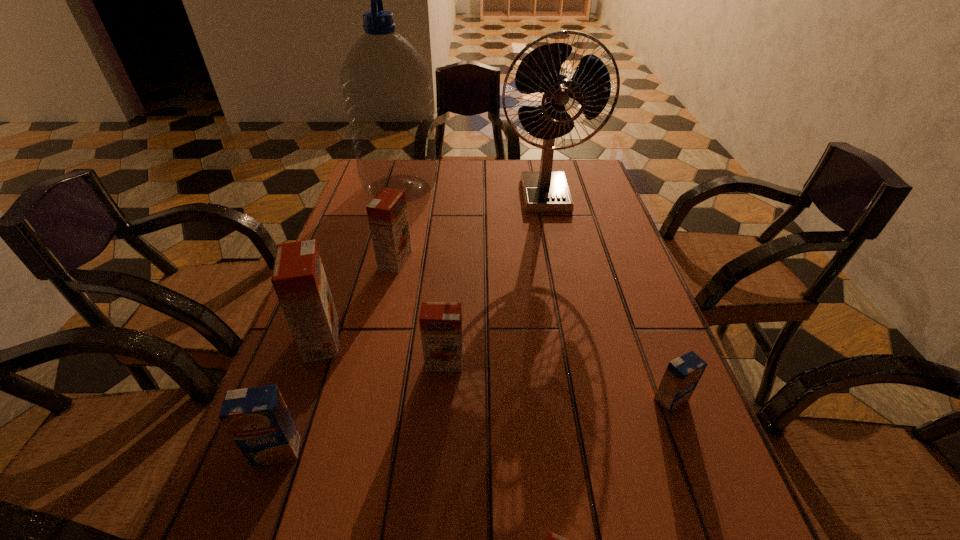
The image size is (960, 540). In order to click on the farther blue orange_juice in this screenshot , I will do `click(682, 375)`.

Locate an element on the screen. the third nearest orange juice is located at coordinates (682, 375).

The height and width of the screenshot is (540, 960). Identify the location of free region located on the front of the blue water jug. (370, 304).

Image resolution: width=960 pixels, height=540 pixels. I want to click on free space located on the front-facing side of the fan, so click(563, 277).

Image resolution: width=960 pixels, height=540 pixels. I want to click on vacant space located on the right of the third tallest object, so click(x=513, y=340).

This screenshot has width=960, height=540. Identify the location of vacant area situated 0.200m on the right of the second biggest orange orange juice. (490, 260).

This screenshot has width=960, height=540. Find the location of `vacant point located on the back of the fourth object from right to left`. vacant point located on the back of the fourth object from right to left is located at coordinates (447, 321).

Where is `free location located on the right of the nearer blue orange_juice`? This screenshot has width=960, height=540. free location located on the right of the nearer blue orange_juice is located at coordinates (415, 450).

Locate an element on the screen. free location located 0.320m on the back of the third nearest object is located at coordinates (624, 276).

At what (x,y) coordinates should I click in order to perform the action: click on water jug that is at the far edge. Please return your answer as a coordinate pair (x, y). The image size is (960, 540). Looking at the image, I should click on (386, 83).